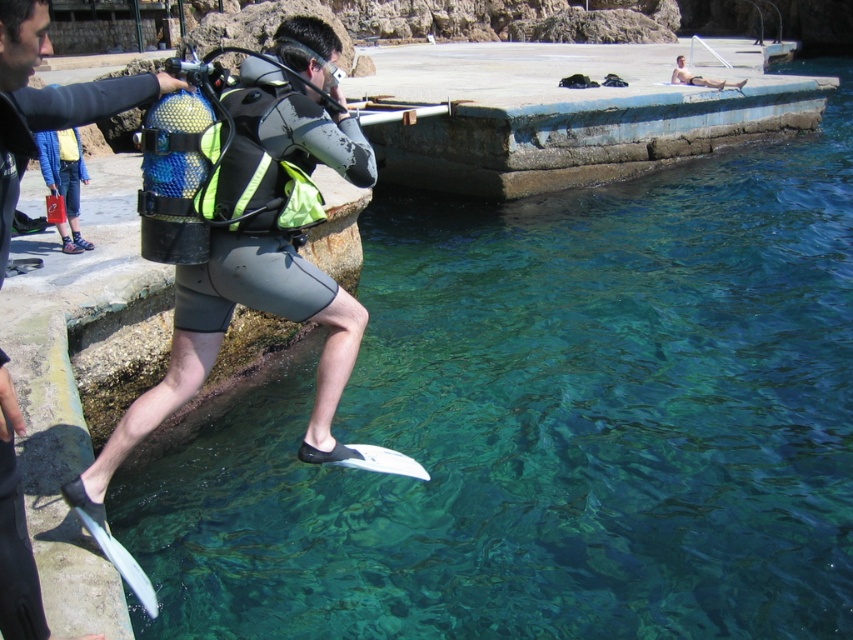
Question: In this image, where is matte black diving suit at center located relative to matte black wetsuit at upper center?

Choices:
 (A) below
 (B) above

Answer: (A)

Question: Estimate the real-world distances between objects in this image. Which object is closer to the matte black diving suit at center?

Choices:
 (A) white plastic surfboard at lower center
 (B) matte black wetsuit at upper center
 (C) matte black fins at lower left

Answer: (C)

Question: Does white plastic surfboard at lower center have a greater width compared to matte black wetsuit at upper center?

Choices:
 (A) yes
 (B) no

Answer: (B)

Question: Is matte black fins at lower left below matte black wetsuit at upper center?

Choices:
 (A) yes
 (B) no

Answer: (A)

Question: Which point is farther to the camera?

Choices:
 (A) matte black diving suit at center
 (B) matte black wetsuit at upper center
 (C) matte black fins at lower left
 (D) white plastic surfboard at lower center

Answer: (B)

Question: Which of the following is the closest to the observer?

Choices:
 (A) matte black diving suit at center
 (B) white plastic surfboard at lower center
 (C) matte black fins at lower left
 (D) matte black wetsuit at upper center

Answer: (C)